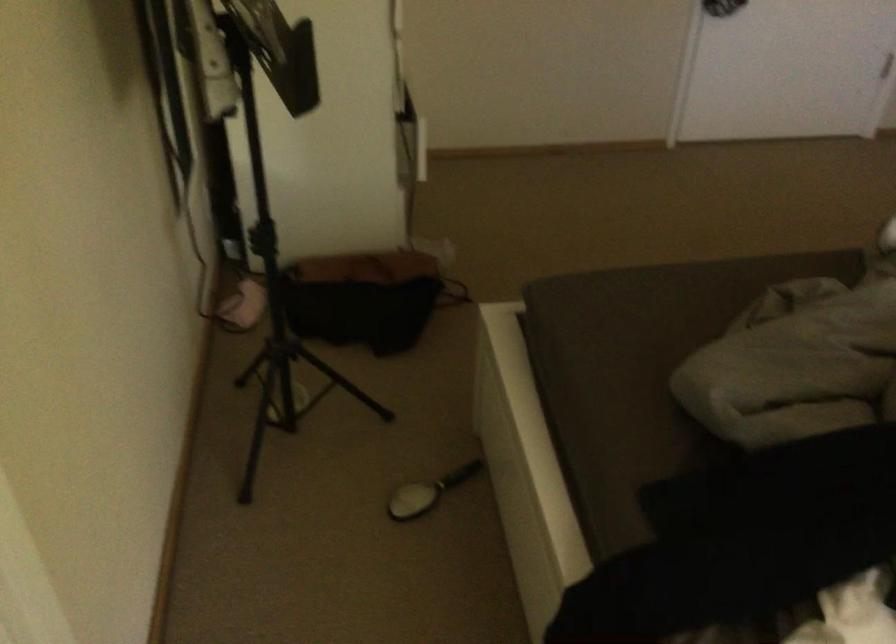
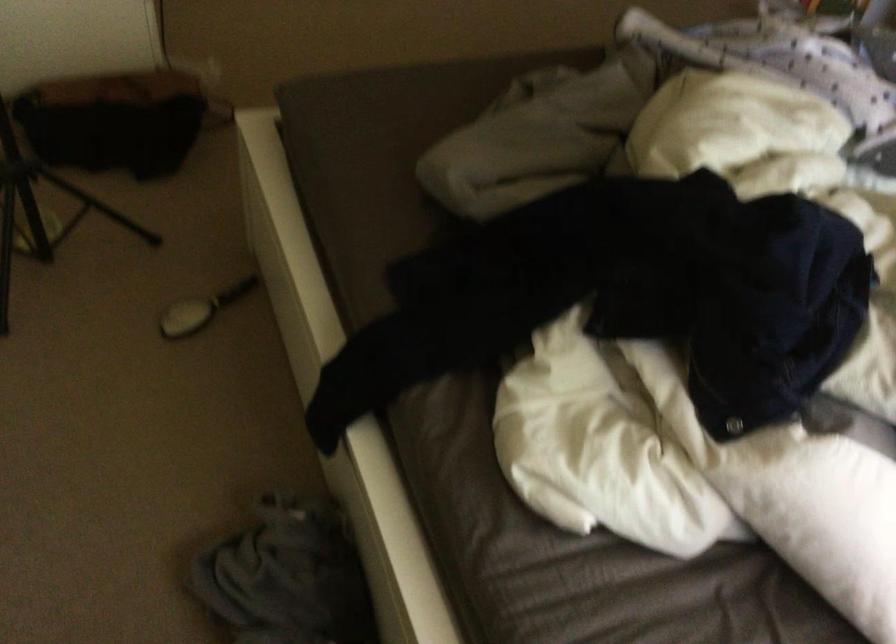
Question: The camera is either moving clockwise (left) or counter-clockwise (right) around the object. The first image is from the beginning of the video and the second image is from the end. Is the camera moving left or right when shooting the video?

Choices:
 (A) Left
 (B) Right

Answer: (A)